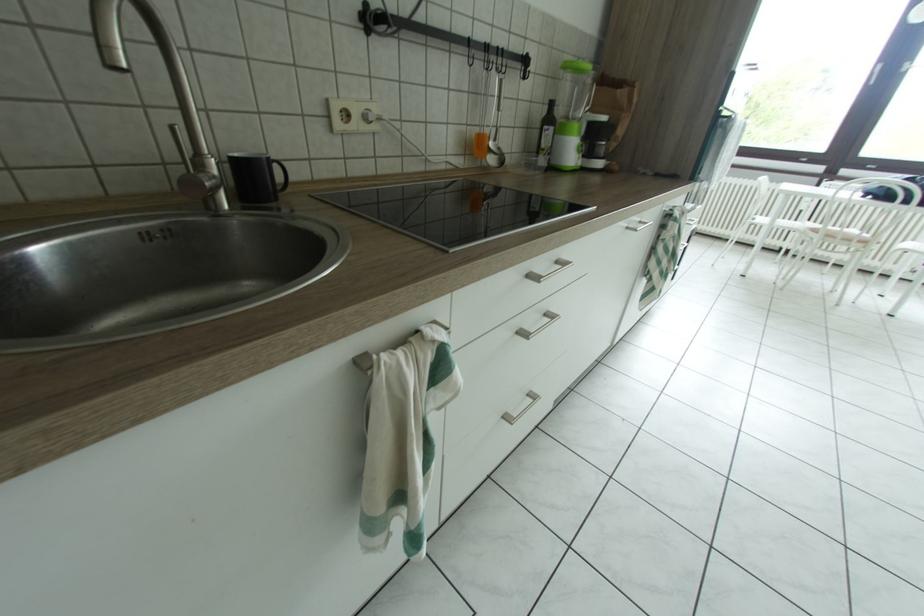
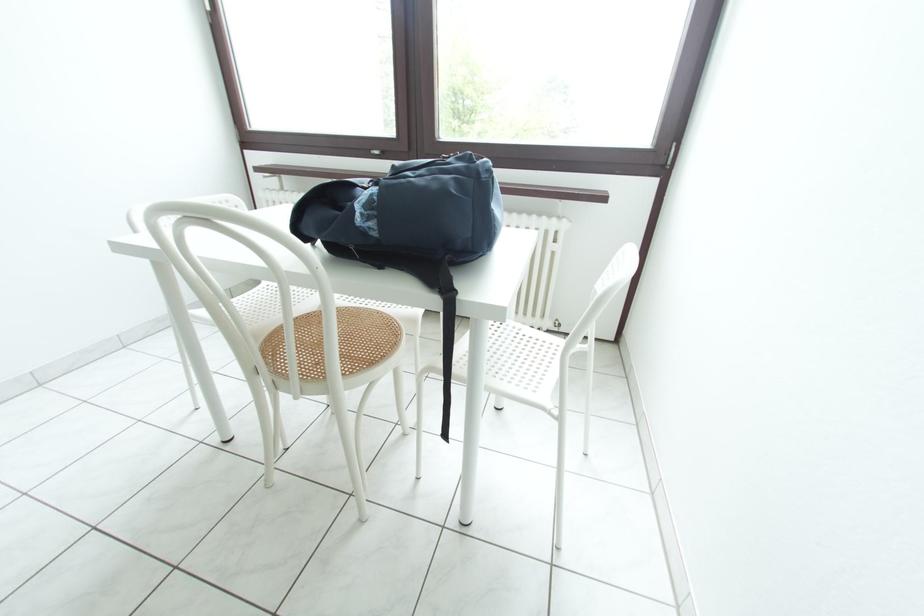
The images are taken continuously from a first-person perspective. In which direction are you moving?

The cameraman moved toward right, forward.